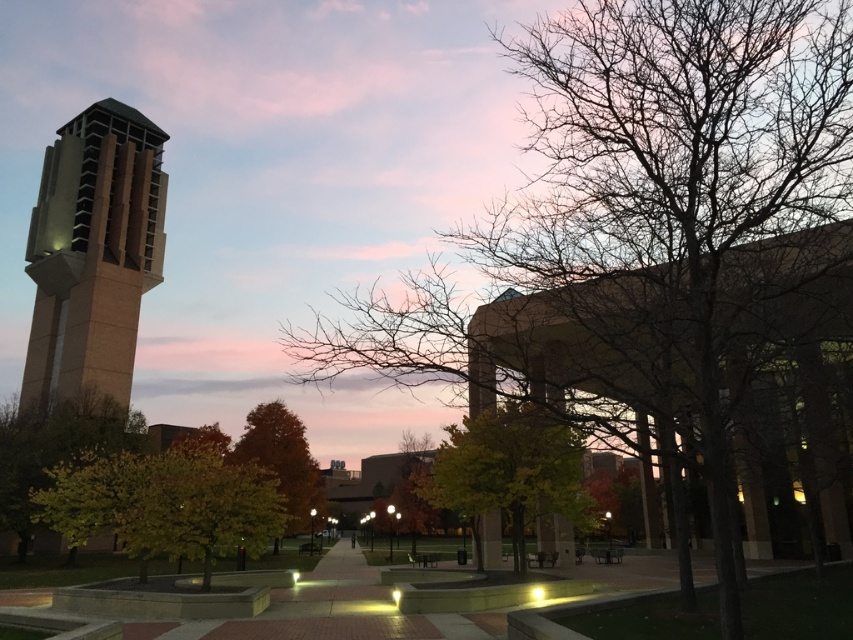
Question: Which of the following is the closest to the observer?

Choices:
 (A) green leafy tree at center
 (B) sandy beige stone bell tower at left
 (C) green leafy tree at left
 (D) golden yellow leaves at center

Answer: (A)

Question: Which object appears closest to the camera in this image?

Choices:
 (A) green leafy tree at center
 (B) green leafy tree at left
 (C) golden yellow leaves at center
 (D) autumn leaves at center

Answer: (A)

Question: Is bare branches at center further to the viewer compared to autumn leaves at center?

Choices:
 (A) yes
 (B) no

Answer: (B)

Question: Is bare branches at center to the right of autumn leaves at center from the viewer's perspective?

Choices:
 (A) yes
 (B) no

Answer: (A)

Question: Which object is positioned closest to the green leafy tree at left?

Choices:
 (A) green leafy tree at center
 (B) golden yellow leaves at center
 (C) bare branches at center

Answer: (B)

Question: From the image, what is the correct spatial relationship of bare branches at center in relation to autumn leaves at center?

Choices:
 (A) below
 (B) above

Answer: (B)